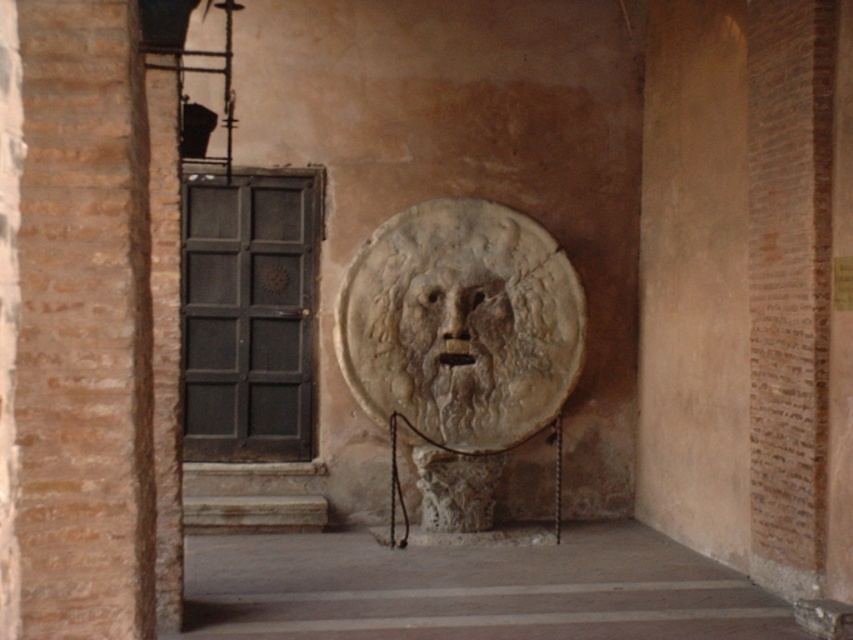
You are standing in the historical interior space and see the white marble face at center and the carved stone face at center. Which one is positioned to the right?

The white marble face at center is positioned to the right of the carved stone face at center.

You are standing in the historical interior space with brick walls. You notice a white marble face at center and a point marked at coordinates (461, 346). Which object is located at those coordinates?

The white marble face at center is located at point (461, 346).